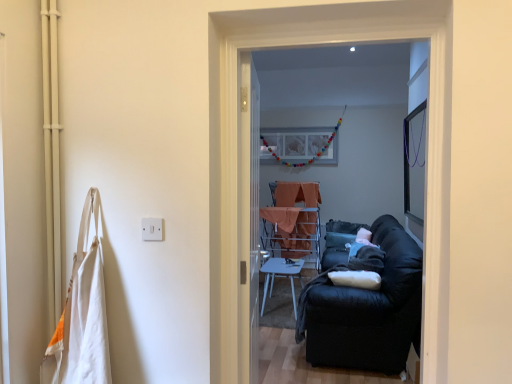
Question: Considering the relative sizes of matte white picture frame at center and white cotton bag at left in the image provided, is matte white picture frame at center thinner than white cotton bag at left?

Choices:
 (A) yes
 (B) no

Answer: (A)

Question: Can you confirm if matte white picture frame at center is shorter than white cotton bag at left?

Choices:
 (A) yes
 (B) no

Answer: (A)

Question: Is matte white picture frame at center looking in the opposite direction of white cotton bag at left?

Choices:
 (A) yes
 (B) no

Answer: (B)

Question: Is matte white picture frame at center oriented towards white cotton bag at left?

Choices:
 (A) no
 (B) yes

Answer: (B)

Question: From the image's perspective, would you say matte white picture frame at center is shown under white cotton bag at left?

Choices:
 (A) yes
 (B) no

Answer: (B)

Question: Is matte white picture frame at center to the left of white cotton bag at left from the viewer's perspective?

Choices:
 (A) yes
 (B) no

Answer: (B)

Question: Can you confirm if clear glass screen door at center, acting as the second screen door starting from the front, is thinner than black fabric screen door at center, acting as the first screen door starting from the front?

Choices:
 (A) yes
 (B) no

Answer: (A)

Question: Can black fabric screen door at center, acting as the second screen door starting from the back, be found inside clear glass screen door at center, the first screen door from the back?

Choices:
 (A) yes
 (B) no

Answer: (B)

Question: Is clear glass screen door at center, the first screen door from the back, with black fabric screen door at center, acting as the first screen door starting from the front?

Choices:
 (A) yes
 (B) no

Answer: (B)

Question: Can you confirm if clear glass screen door at center, the first screen door from the back, is bigger than black fabric screen door at center, acting as the second screen door starting from the back?

Choices:
 (A) no
 (B) yes

Answer: (B)

Question: Considering the relative sizes of clear glass screen door at center, the first screen door from the back, and black fabric screen door at center, acting as the first screen door starting from the front, in the image provided, is clear glass screen door at center, the first screen door from the back, wider than black fabric screen door at center, acting as the first screen door starting from the front,?

Choices:
 (A) no
 (B) yes

Answer: (A)

Question: Does clear glass screen door at center, acting as the second screen door starting from the front, have a greater height compared to black fabric screen door at center, acting as the first screen door starting from the front?

Choices:
 (A) no
 (B) yes

Answer: (B)

Question: Is black fabric couch at right bigger than white glossy table at center?

Choices:
 (A) yes
 (B) no

Answer: (A)